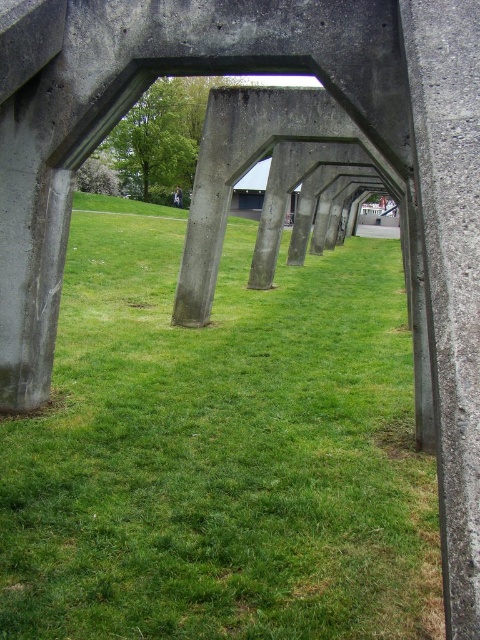
Who is more distant from viewer, (352, 496) or (147, 49)?

The point (147, 49) is behind.

Where is `green grassy at center`? This screenshot has width=480, height=640. green grassy at center is located at coordinates (219, 451).

Identify the location of green grassy at center. coord(219,451).